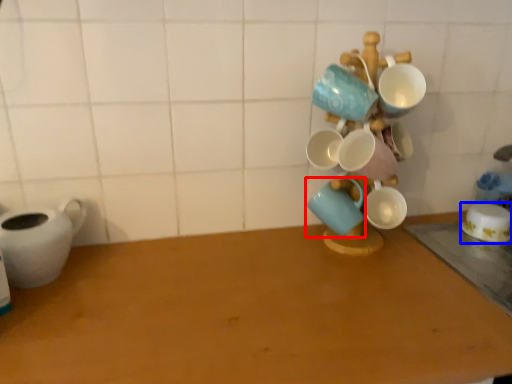
Question: Which of the following is the farthest to the observer, coffee cup (highlighted by a red box) or coffee cup (highlighted by a blue box)?

Choices:
 (A) coffee cup
 (B) coffee cup

Answer: (B)